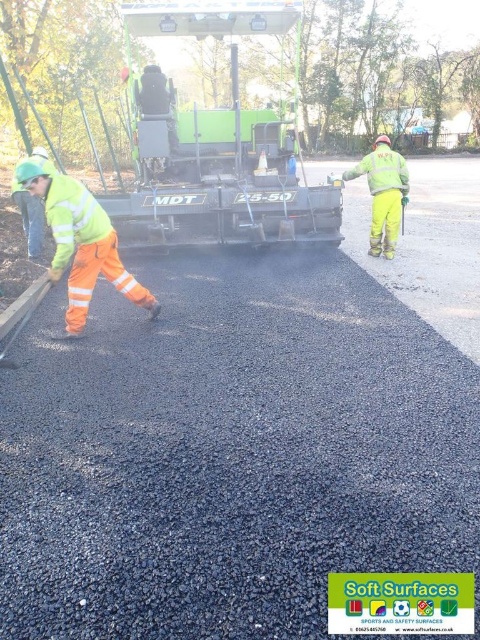
Is hi-visibility reflective jacket at left further to the viewer compared to high visibility reflective jacket at center?

That is False.

Who is positioned more to the left, hi-visibility reflective jacket at left or high visibility reflective jacket at center?

From the viewer's perspective, hi-visibility reflective jacket at left appears more on the left side.

This screenshot has width=480, height=640. I want to click on hi-visibility reflective jacket at left, so [81, 243].

Describe the element at coordinates (216, 145) in the screenshot. Image resolution: width=480 pixels, height=640 pixels. I see `green rubber asphalt spreader at center` at that location.

Looking at this image, can you confirm if green rubber asphalt spreader at center is smaller than hi-visibility reflective jacket at left?

No, green rubber asphalt spreader at center is not smaller than hi-visibility reflective jacket at left.

The image size is (480, 640). Find the location of `green rubber asphalt spreader at center`. green rubber asphalt spreader at center is located at coordinates (216, 145).

Looking at this image, can you confirm if green rubber asphalt spreader at center is taller than high visibility reflective jacket at center?

Indeed, green rubber asphalt spreader at center has a greater height compared to high visibility reflective jacket at center.

Does point (133, 104) lie behind point (371, 172)?

Yes, point (133, 104) is farther from viewer.

Locate an element on the screen. This screenshot has height=640, width=480. green rubber asphalt spreader at center is located at coordinates (216, 145).